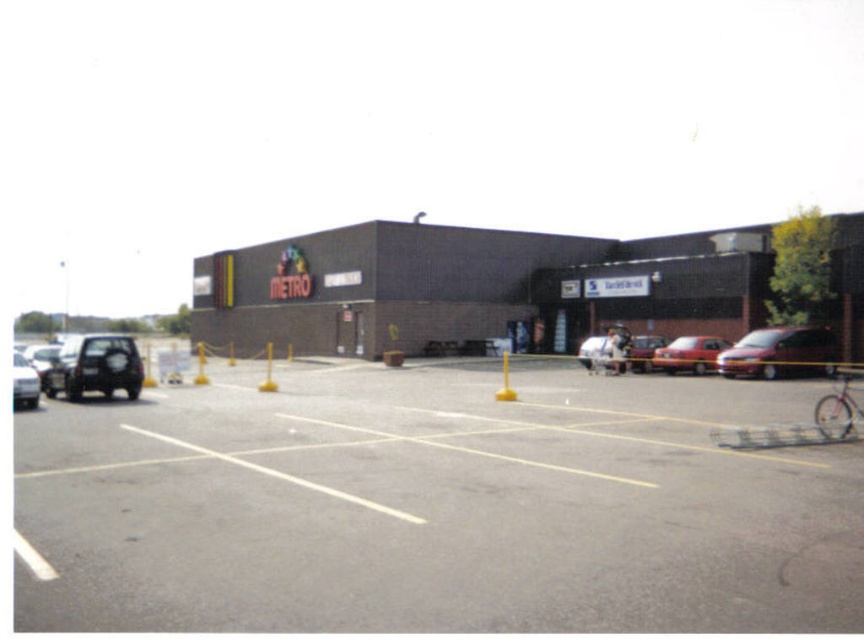
Question: Which is farther from the white glossy car at left?

Choices:
 (A) metallic maroon van at right
 (B) matte black suv at left
 (C) matte red car at right

Answer: (C)

Question: Considering the real-world distances, which object is farthest from the gray asphalt parking lot at center?

Choices:
 (A) matte red car at right
 (B) matte black suv at left
 (C) metallic maroon van at right
 (D) white glossy car at left

Answer: (A)

Question: Is gray asphalt parking lot at center closer to camera compared to metallic maroon van at right?

Choices:
 (A) yes
 (B) no

Answer: (A)

Question: Can you confirm if metallic maroon van at right is positioned to the right of white glossy car at left?

Choices:
 (A) no
 (B) yes

Answer: (B)

Question: Which point is farther to the camera?

Choices:
 (A) (73, 362)
 (B) (675, 365)
 (C) (27, 396)
 (D) (731, 365)

Answer: (B)

Question: Is matte black suv at left further to camera compared to white glossy car at left?

Choices:
 (A) yes
 (B) no

Answer: (A)